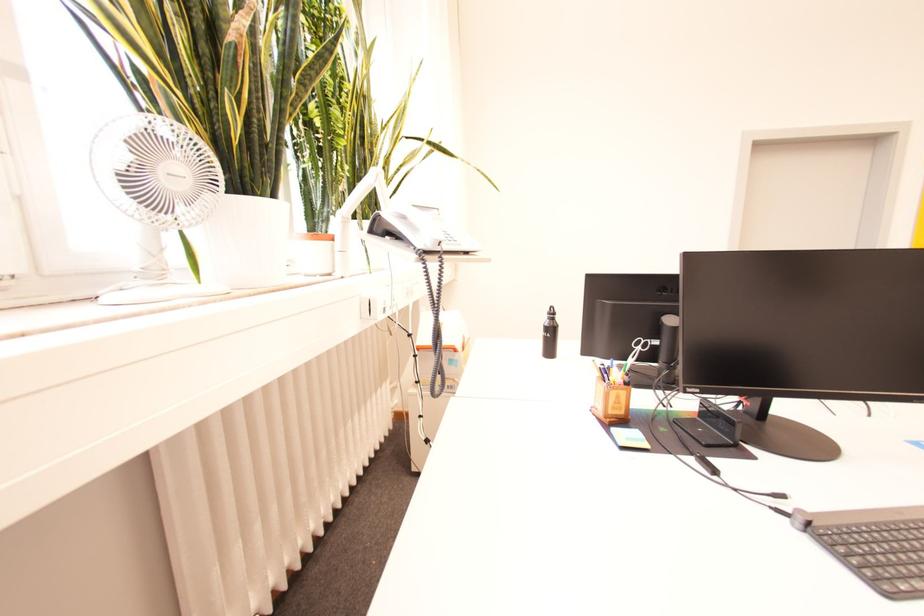
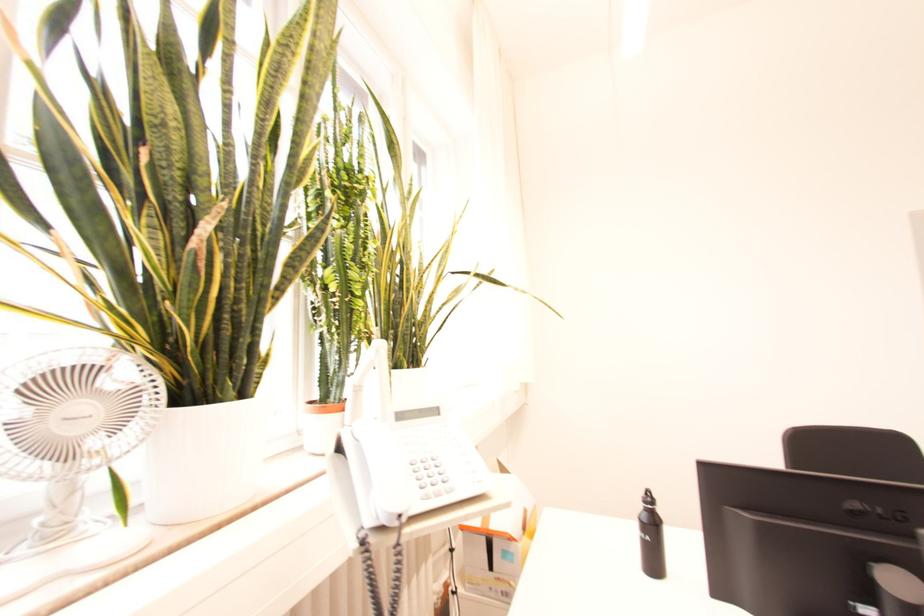
Locate, in the second image, the point that corresponds to [553,339] in the first image.

(650, 543)